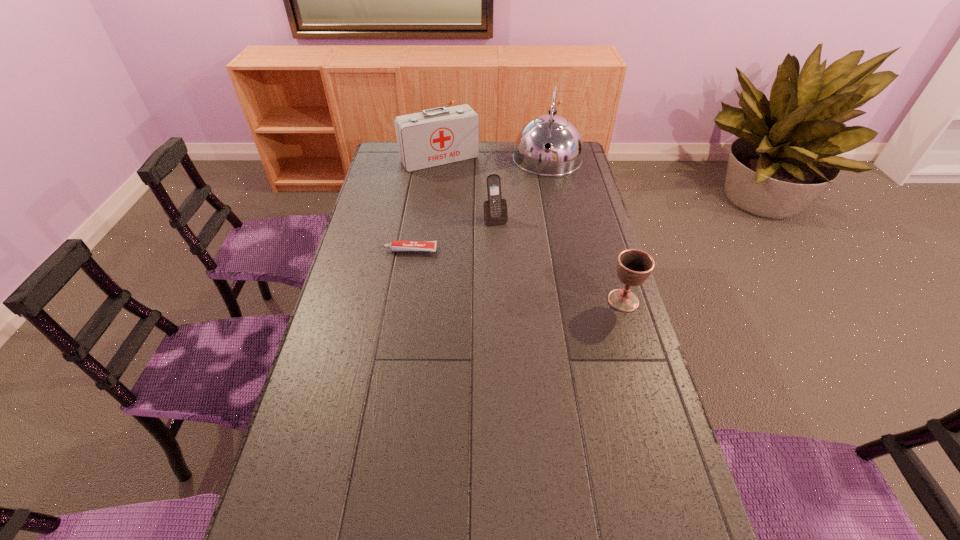
Identify the location of free space on the desktop that is between the toothpaste and the nearest object and is positioned on the front-facing side of the second tallest object. The width and height of the screenshot is (960, 540). (519, 276).

Identify the location of free spot on the desktop that is between the second nearest object and the nearest object and is positioned on the front-facing side of the third object from left to right. (514, 274).

Locate an element on the screen. The width and height of the screenshot is (960, 540). vacant spot on the desktop that is between the toothpaste and the nearest object and is positioned from the spout of the kettle is located at coordinates (529, 278).